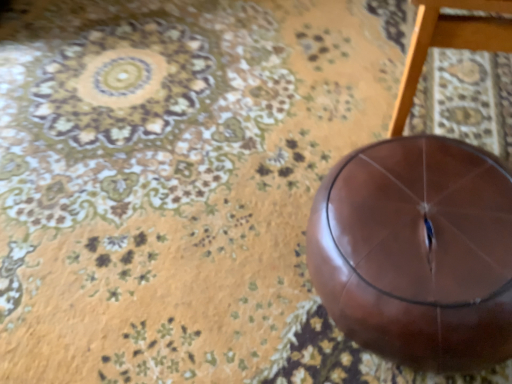
This screenshot has width=512, height=384. What do you see at coordinates (417, 252) in the screenshot?
I see `glossy leather ball at center` at bounding box center [417, 252].

The image size is (512, 384). In order to click on glossy leather ball at center in this screenshot , I will do `click(417, 252)`.

Describe the element at coordinates (448, 42) in the screenshot. I see `glossy brown stool at center` at that location.

Measure the distance between glossy brown stool at center and camera.

glossy brown stool at center is 24.19 inches from camera.

The height and width of the screenshot is (384, 512). In order to click on glossy brown stool at center in this screenshot , I will do `click(448, 42)`.

At what (x,y) coordinates should I click in order to perform the action: click on glossy leather ball at center. Please return your answer as a coordinate pair (x, y). Image resolution: width=512 pixels, height=384 pixels. Looking at the image, I should click on pyautogui.click(x=417, y=252).

In the image, is glossy brown stool at center on the left side or the right side of glossy leather ball at center?

glossy brown stool at center is positioned on glossy leather ball at center's right side.

Between glossy brown stool at center and glossy leather ball at center, which one is positioned in front?

glossy brown stool at center.

Is point (426, 53) farther from camera compared to point (399, 157)?

That is False.

From the image's perspective, which is below, glossy brown stool at center or glossy leather ball at center?

glossy leather ball at center, from the image's perspective.

From a real-world perspective, between glossy brown stool at center and glossy leather ball at center, who is vertically higher?

glossy brown stool at center is physically above.

In terms of width, does glossy brown stool at center look wider or thinner when compared to glossy leather ball at center?

In the image, glossy brown stool at center appears to be more narrow than glossy leather ball at center.

Who is taller, glossy brown stool at center or glossy leather ball at center?

With more height is glossy brown stool at center.

Can you confirm if glossy brown stool at center is bigger than glossy leather ball at center?

Yes.

Choose the correct answer: Is glossy brown stool at center inside glossy leather ball at center or outside it?

glossy brown stool at center is not inside glossy leather ball at center, it's outside.

Is the surface of glossy brown stool at center in direct contact with glossy leather ball at center?

No, glossy brown stool at center is not touching glossy leather ball at center.

Could you tell me if glossy brown stool at center is turned towards glossy leather ball at center?

No, glossy brown stool at center is not aimed at glossy leather ball at center.

How many degrees apart are the facing directions of glossy brown stool at center and glossy leather ball at center?

1.21 degrees separate the facing orientations of glossy brown stool at center and glossy leather ball at center.

Locate an element on the screen. The width and height of the screenshot is (512, 384). furniture to the right of glossy leather ball at center is located at coordinates (448, 42).

In the image, is glossy leather ball at center on the left side or the right side of glossy brown stool at center?

glossy leather ball at center is to the left of glossy brown stool at center.

Between glossy leather ball at center and glossy brown stool at center, which one is positioned in front?

glossy brown stool at center is in front.

Which is behind, point (448, 335) or point (455, 46)?

The point (455, 46) is behind.

From the image's perspective, who appears lower, glossy leather ball at center or glossy brown stool at center?

glossy leather ball at center, from the image's perspective.

From a real-world perspective, is glossy leather ball at center over glossy brown stool at center?

No, from a real-world perspective, glossy leather ball at center is not above glossy brown stool at center.

Considering the sizes of objects glossy leather ball at center and glossy brown stool at center in the image provided, who is thinner, glossy leather ball at center or glossy brown stool at center?

Thinner between the two is glossy brown stool at center.

Can you confirm if glossy leather ball at center is taller than glossy brown stool at center?

No.

Consider the image. Between glossy leather ball at center and glossy brown stool at center, which one has smaller size?

glossy leather ball at center.

Can we say glossy leather ball at center lies outside glossy brown stool at center?

Yes, glossy leather ball at center is outside of glossy brown stool at center.

Would you consider glossy leather ball at center to be distant from glossy brown stool at center?

Actually, glossy leather ball at center and glossy brown stool at center are a little close together.

From the picture: Is glossy leather ball at center facing towards glossy brown stool at center?

No, glossy leather ball at center is not facing towards glossy brown stool at center.

Based on the photo, how different are the orientations of glossy leather ball at center and glossy brown stool at center in degrees?

The facing directions of glossy leather ball at center and glossy brown stool at center are 1.21 degrees apart.

Locate an element on the screen. This screenshot has width=512, height=384. furniture in front of the glossy leather ball at center is located at coordinates (448, 42).

What are the coordinates of `furniture that appears on the right of glossy leather ball at center` in the screenshot? It's located at (448, 42).

Identify the location of ball lying behind the glossy brown stool at center. This screenshot has height=384, width=512. (417, 252).